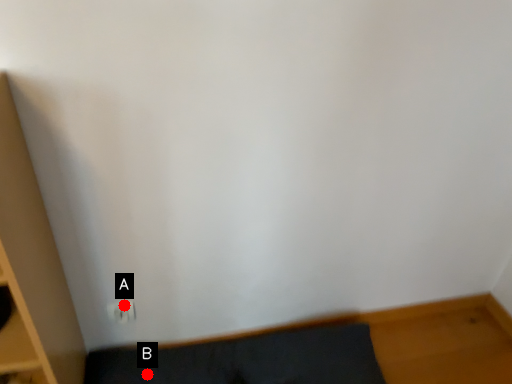
Question: Two points are circled on the image, labeled by A and B beside each circle. Which point is further to the camera?

Choices:
 (A) A is further
 (B) B is further

Answer: (B)